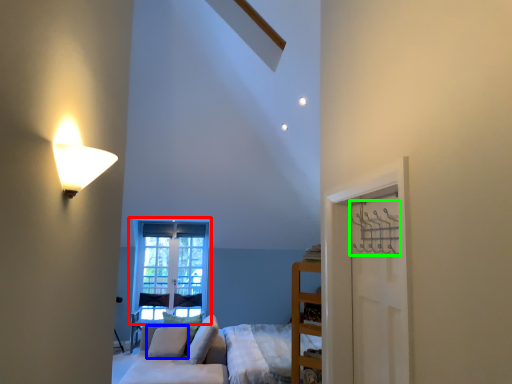
Question: Based on their relative distances, which object is farther from window (highlighted by a red box)? Choose from pillow (highlighted by a blue box) and hanger (highlighted by a green box).

Choices:
 (A) pillow
 (B) hanger

Answer: (B)